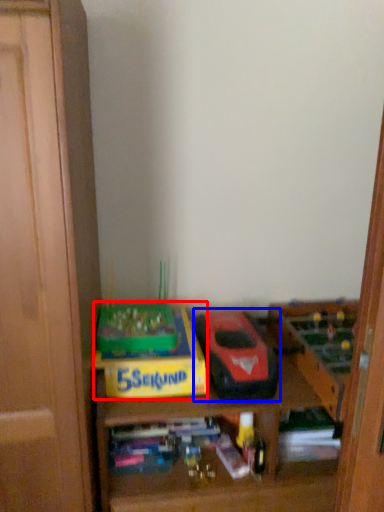
Question: Among these objects, which one is nearest to the camera, cardboard box (highlighted by a red box) or model car (highlighted by a blue box)?

Choices:
 (A) cardboard box
 (B) model car

Answer: (B)